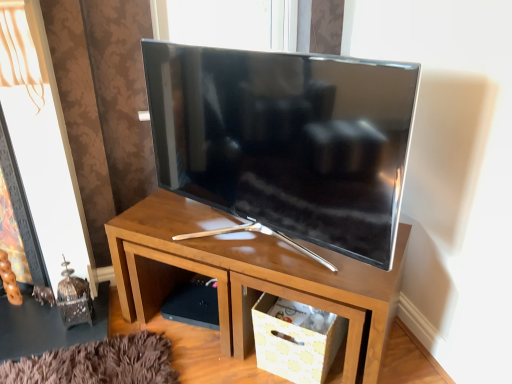
Locate an element on the screen. free region on the left part of white paper storage box at lower right is located at coordinates (220, 365).